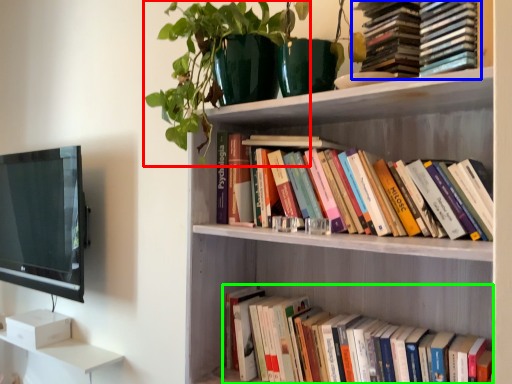
Question: Estimate the real-world distances between objects in this image. Which object is closer to plant (highlighted by a red box), book (highlighted by a blue box) or book (highlighted by a green box)?

Choices:
 (A) book
 (B) book

Answer: (A)